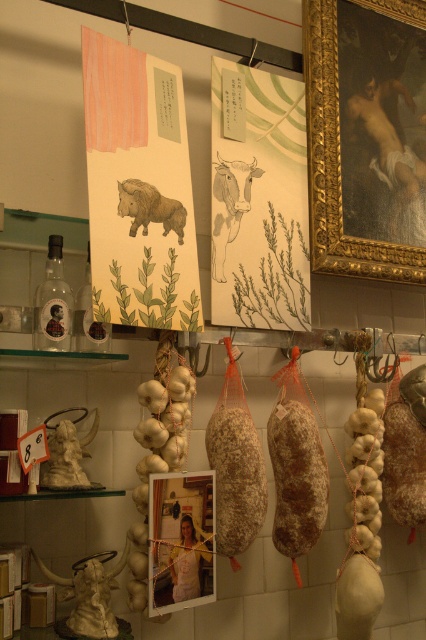
You are a customer in a rustic food shop and want to find the matte plastic photo frame at center. Where should you look?

The matte plastic photo frame at center is located at point (181, 540).

You are a customer in the store and want to see the brown textured boar at center behind the matte plastic photo frame at center. Can you move the photo frame to access it?

The matte plastic photo frame at center is in front of the brown textured boar at center, so you can move the photo frame to access the brown textured boar at center.

You are an interior designer planning to hang a new picture in this rustic food shop. The new picture must be placed to the left of the gold ornate frame at upper right. Based on the current layout, where should you position the new picture?

Result: The gold ornate frame at upper right is located at point [339,166], so the new picture should be placed to the left of this coordinate.